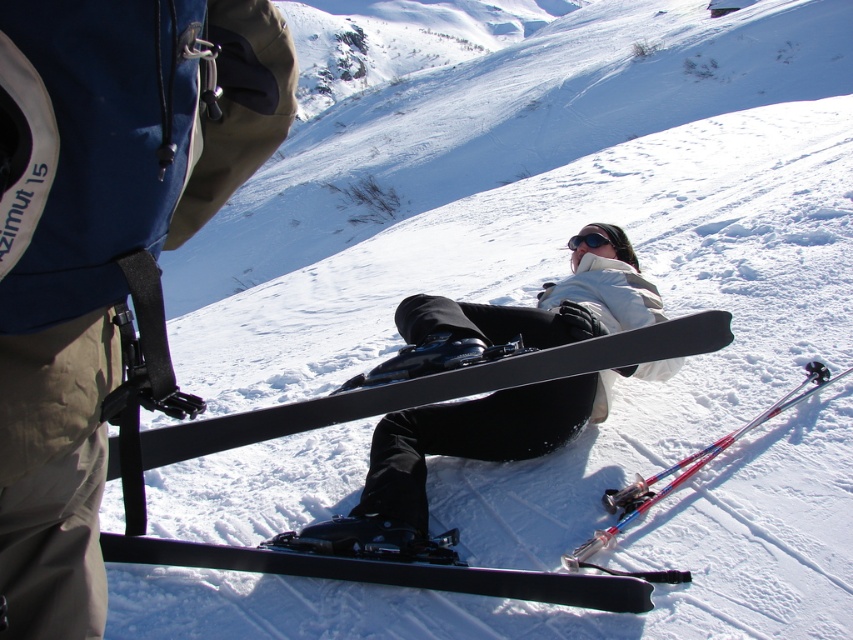
Question: Can you confirm if matte black snowboard at center is positioned to the right of black matte/solid ski at center?

Choices:
 (A) no
 (B) yes

Answer: (B)

Question: Does matte black snowboard at center have a smaller size compared to black matte ski at center?

Choices:
 (A) no
 (B) yes

Answer: (A)

Question: Among these objects, which one is farthest from the camera?

Choices:
 (A) black matte/solid ski at center
 (B) black matte goggles at center
 (C) matte black snowboard at center
 (D) black matte ski at center

Answer: (B)

Question: Which of the following is the closest to the observer?

Choices:
 (A) black matte/solid ski at center
 (B) matte black snowboard at center
 (C) black matte ski at center

Answer: (C)

Question: Which point is closer to the camera?

Choices:
 (A) (113, 540)
 (B) (250, 413)
 (C) (421, 488)
 (D) (585, 227)

Answer: (A)

Question: Does black matte ski at center have a greater width compared to black matte goggles at center?

Choices:
 (A) no
 (B) yes

Answer: (B)